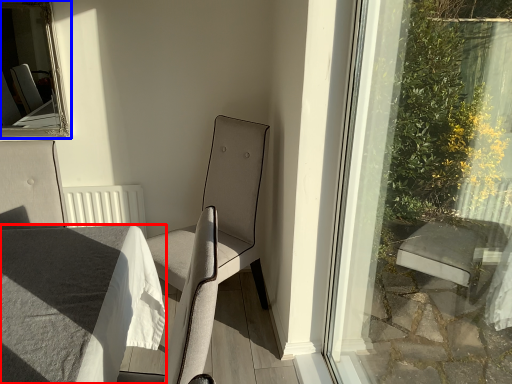
Question: Among these objects, which one is nearest to the camera, table (highlighted by a red box) or bay window (highlighted by a blue box)?

Choices:
 (A) table
 (B) bay window

Answer: (A)